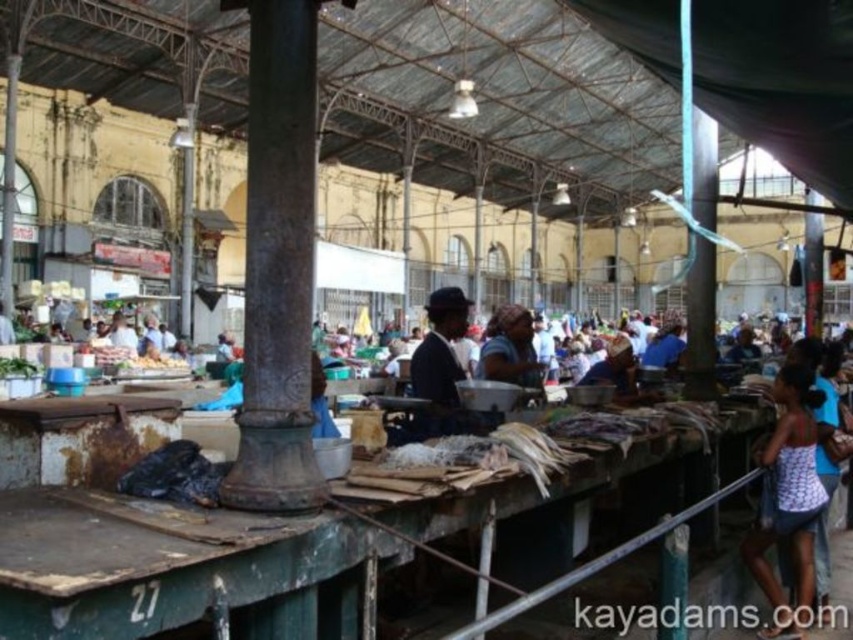
Question: Which point is farther from the camera taking this photo?

Choices:
 (A) (434, 339)
 (B) (254, 339)

Answer: (A)

Question: Is white printed tank top at right wider than matte black suit at center?

Choices:
 (A) yes
 (B) no

Answer: (A)

Question: Can you confirm if white printed tank top at right is bigger than matte black suit at center?

Choices:
 (A) yes
 (B) no

Answer: (B)

Question: Can you confirm if rusty metal pillar at center is positioned to the right of matte black suit at center?

Choices:
 (A) yes
 (B) no

Answer: (B)

Question: Among these points, which one is nearest to the camera?

Choices:
 (A) (440, 396)
 (B) (291, 305)
 (C) (486, 378)

Answer: (B)

Question: Estimate the real-world distances between objects in this image. Which object is farther from the matte black suit at center?

Choices:
 (A) matte brown headscarf at center
 (B) white printed tank top at right

Answer: (B)